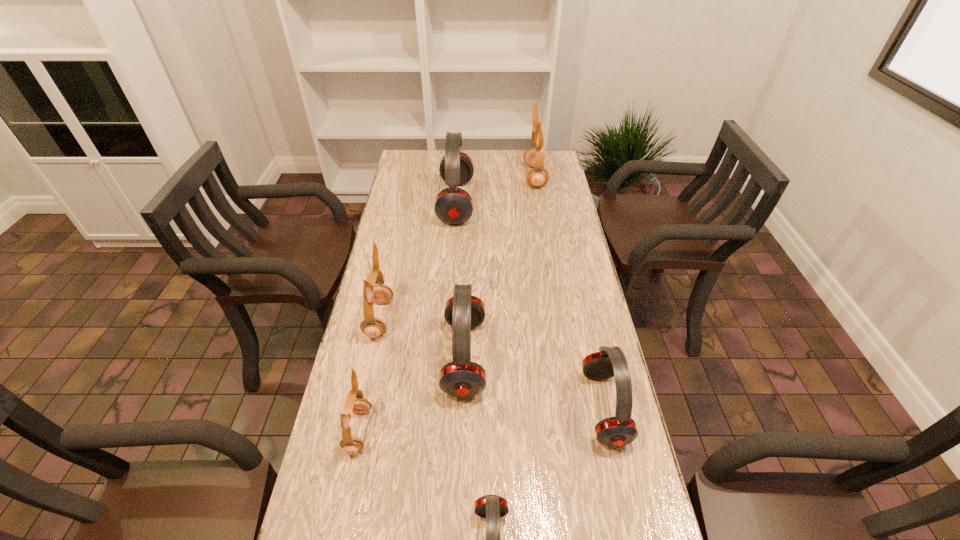
At what (x,y) coordinates should I click in order to perform the action: click on earphone that is the fifth closest one to the rightmost red earphone. Please return your answer as a coordinate pair (x, y). Looking at the image, I should click on (453, 205).

Find the location of `brown earphone that is the second closest to the biggest red earphone`. brown earphone that is the second closest to the biggest red earphone is located at coordinates (373, 327).

Identify which brown earphone is the second closest to the rightmost red earphone. Please provide its 2D coordinates. Your answer should be formatted as a tuple, i.e. [(x, y)], where the tuple contains the x and y coordinates of a point satisfying the conditions above.

[(373, 327)]

Select which red earphone appears as the second closest to the shortest earphone. Please provide its 2D coordinates. Your answer should be formatted as a tuple, i.e. [(x, y)], where the tuple contains the x and y coordinates of a point satisfying the conditions above.

[(620, 430)]

The width and height of the screenshot is (960, 540). What are the coordinates of `red earphone that is the third nearest to the biggest red earphone` in the screenshot? It's located at (492, 507).